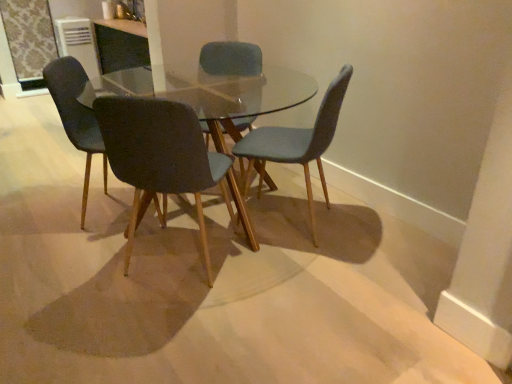
This screenshot has width=512, height=384. I want to click on vacant point to the left of clear glass table at center, so (52, 221).